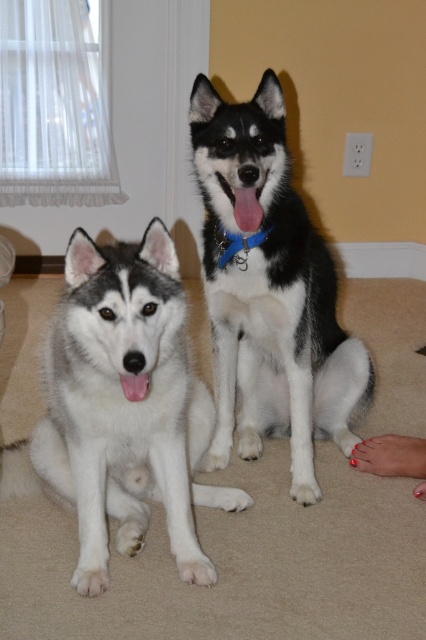
You are a dog trainer observing two dogs in the image. The dogs are the white fluffy dog at center and the black and white fur at center. Which dog is shorter in height?

The white fluffy dog at center is shorter in height compared to the black and white fur at center.

You are a photographer trying to capture a closeup of the two points in the image. Which point, point (160, 225) or point (250, 243), is closer to your camera?

Point (160, 225) is closer to the camera than point (250, 243).

You are a photographer trying to capture a clear shot of both the black and white fur at center and the blue fabric neckband at center. Which object should you focus on first to ensure both are in focus?

The black and white fur at center is closer to the viewer than the blue fabric neckband at center. To ensure both are in focus, focus on the black and white fur at center first as it is closer, allowing the blue fabric neckband at center to fall within the depth of field.